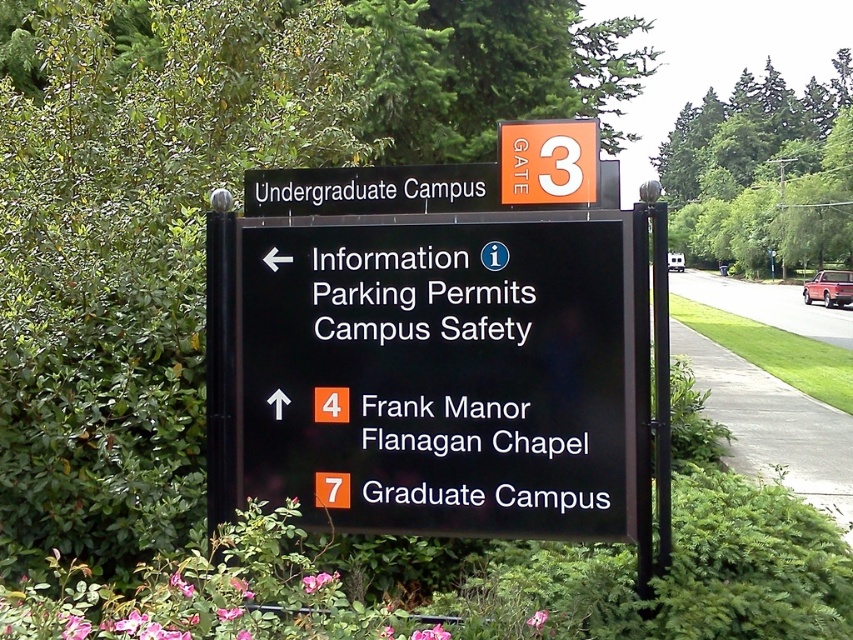
Does black plastic sign at center have a lesser width compared to orange matte gate at upper center?

In fact, black plastic sign at center might be wider than orange matte gate at upper center.

From the picture: Does black plastic sign at center appear under orange matte gate at upper center?

Indeed, black plastic sign at center is positioned under orange matte gate at upper center.

In order to click on black plastic sign at center in this screenshot , I will do `click(469, 372)`.

Find the location of `black plastic sign at center`. black plastic sign at center is located at coordinates (469, 372).

Image resolution: width=853 pixels, height=640 pixels. What are the coordinates of `black plastic sign at upper center` in the screenshot? It's located at (370, 189).

What are the coordinates of `black plastic sign at upper center` in the screenshot? It's located at (370, 189).

Which of these two, black plastic sign at center or black plastic sign at upper center, stands taller?

black plastic sign at center

I want to click on black plastic sign at center, so click(469, 372).

Where is `black plastic sign at center`? The height and width of the screenshot is (640, 853). black plastic sign at center is located at coordinates (469, 372).